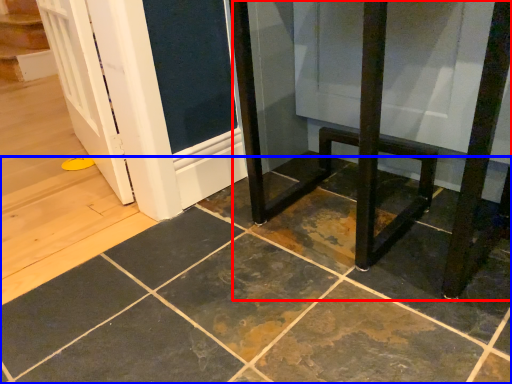
Question: Which object appears closest to the camera in this image, furniture (highlighted by a red box) or ceramic tile (highlighted by a blue box)?

Choices:
 (A) furniture
 (B) ceramic tile

Answer: (B)